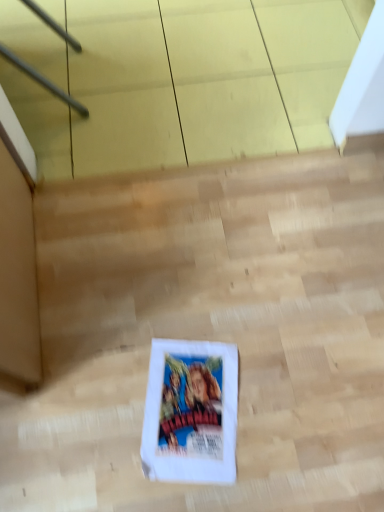
The image size is (384, 512). Identify the location of free space behind white paper comic book at center. (197, 308).